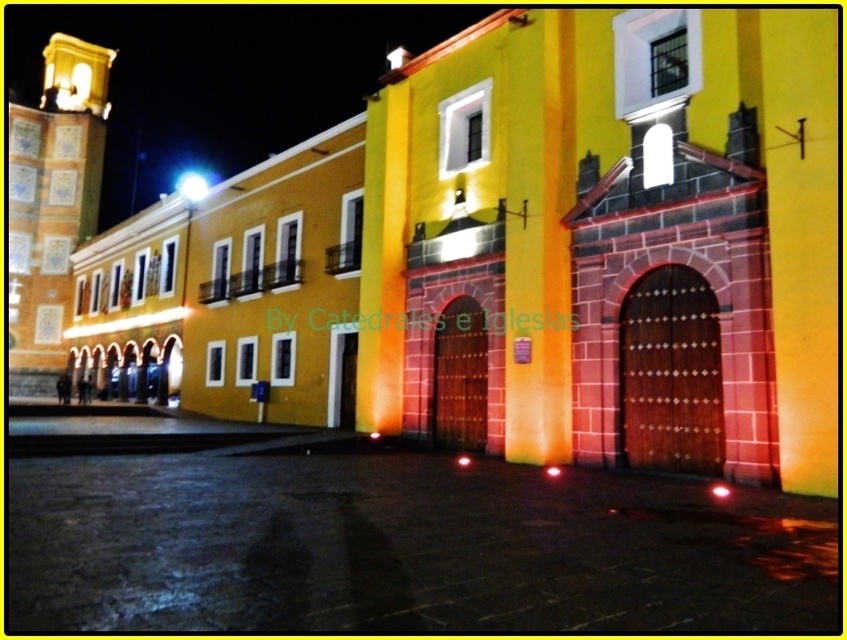
Question: Which point is farther to the camera?

Choices:
 (A) matte yellow church at center
 (B) golden mosaic tile bell tower at left

Answer: (B)

Question: Does matte yellow church at center have a lesser width compared to golden mosaic tile bell tower at left?

Choices:
 (A) no
 (B) yes

Answer: (B)

Question: Does matte yellow church at center come in front of golden mosaic tile bell tower at left?

Choices:
 (A) yes
 (B) no

Answer: (A)

Question: Which object appears closest to the camera in this image?

Choices:
 (A) golden mosaic tile bell tower at left
 (B) matte yellow church at center

Answer: (B)

Question: Is matte yellow church at center positioned at the back of golden mosaic tile bell tower at left?

Choices:
 (A) yes
 (B) no

Answer: (B)

Question: Among these objects, which one is nearest to the camera?

Choices:
 (A) golden mosaic tile bell tower at left
 (B) matte yellow church at center

Answer: (B)